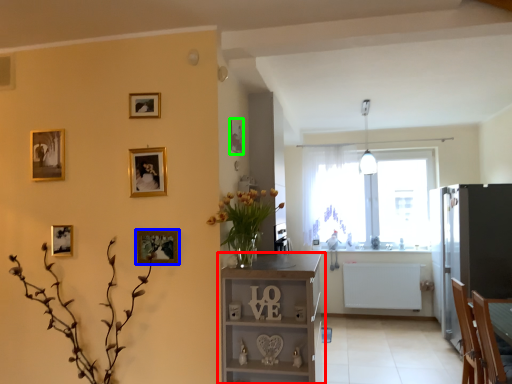
Question: Considering the real-world distances, which object is closest to shelf (highlighted by a red box)? picture frame (highlighted by a blue box) or picture frame (highlighted by a green box).

Choices:
 (A) picture frame
 (B) picture frame

Answer: (A)